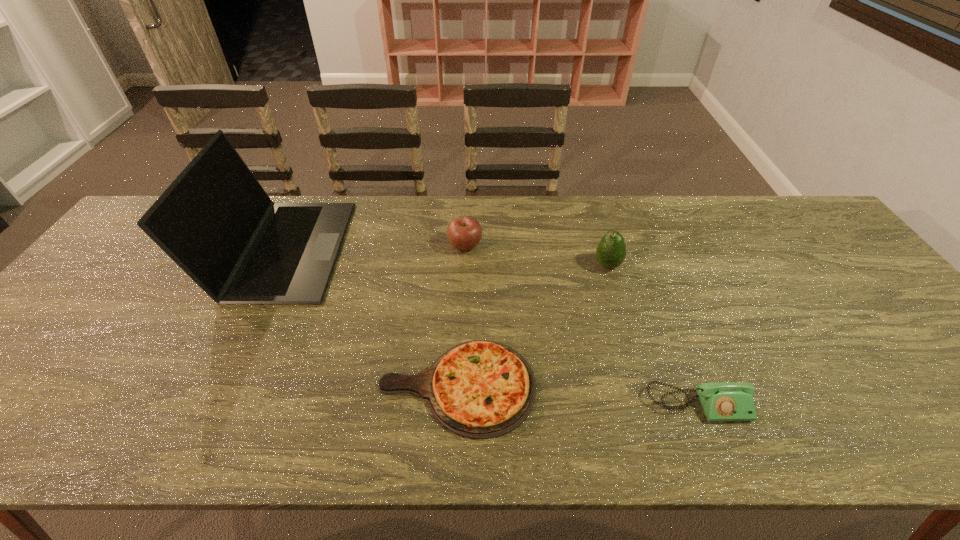
This screenshot has width=960, height=540. Identify the location of blank area located on the back of the shortest object. (461, 286).

Locate an element on the screen. The image size is (960, 540). laptop that is at the far edge is located at coordinates (215, 221).

Where is `apple at the far edge`? The width and height of the screenshot is (960, 540). apple at the far edge is located at coordinates (464, 233).

Locate an element on the screen. The width and height of the screenshot is (960, 540). telephone situated at the near edge is located at coordinates (728, 401).

Where is `pizza at the near edge`? The width and height of the screenshot is (960, 540). pizza at the near edge is located at coordinates (480, 389).

Locate an element on the screen. This screenshot has height=540, width=960. free space at the far edge of the desktop is located at coordinates (571, 213).

This screenshot has width=960, height=540. I want to click on free region at the near edge of the desktop, so pyautogui.click(x=291, y=446).

Where is `vacant space at the left edge of the desktop`? Image resolution: width=960 pixels, height=540 pixels. vacant space at the left edge of the desktop is located at coordinates (142, 286).

Image resolution: width=960 pixels, height=540 pixels. What are the coordinates of `free space between the laptop and the fourth shortest object` in the screenshot? It's located at (445, 257).

The image size is (960, 540). I want to click on vacant point located between the pizza and the third shortest object, so click(x=461, y=316).